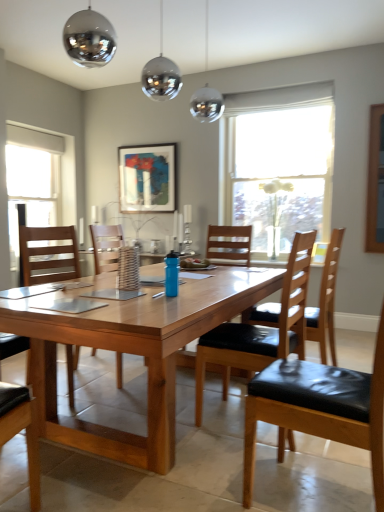
This screenshot has height=512, width=384. I want to click on free area behind black leather chair at right, marked as the second chair in a right-to-left arrangement, so click(294, 456).